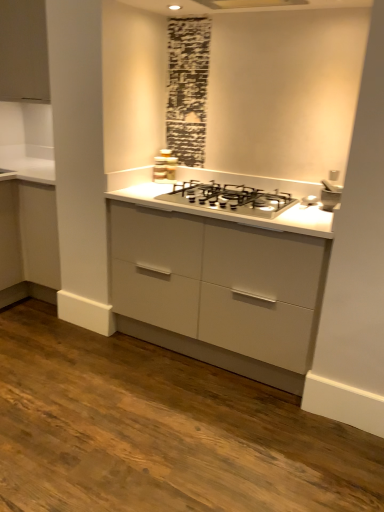
Question: In terms of width, does satin silver stove at center look wider or thinner when compared to matte white cabinet at upper left?

Choices:
 (A) thin
 (B) wide

Answer: (A)

Question: From a real-world perspective, relative to matte white cabinet at upper left, is satin silver stove at center vertically above or below?

Choices:
 (A) below
 (B) above

Answer: (A)

Question: Which object is positioned closest to the matte white cabinet at upper left?

Choices:
 (A) satin silver stove at center
 (B) satin silver gas stove at center
 (C) white ceramic sink at upper right

Answer: (A)

Question: Which is nearer to the satin silver stove at center?

Choices:
 (A) white ceramic sink at upper right
 (B) satin silver gas stove at center
 (C) matte white cabinet at upper left

Answer: (B)